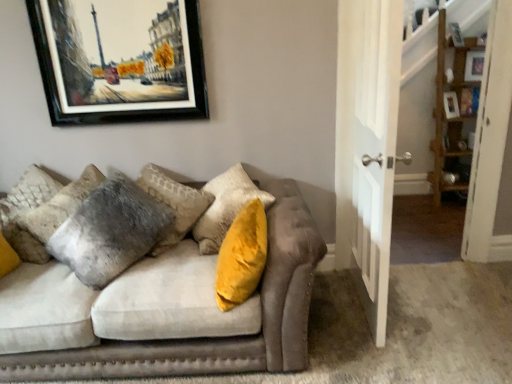
The height and width of the screenshot is (384, 512). I want to click on free space in front of white wooden door at center, so click(393, 352).